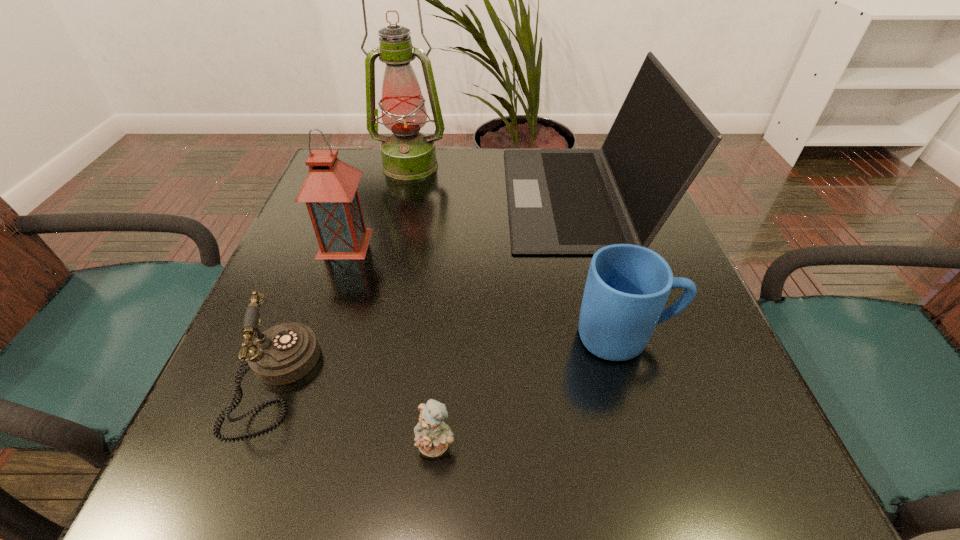
Locate an element on the screen. vacant space that satisfies the following two spatial constraints: 1. on the screen of the laptop; 2. on the front side of the telephone is located at coordinates [x=630, y=381].